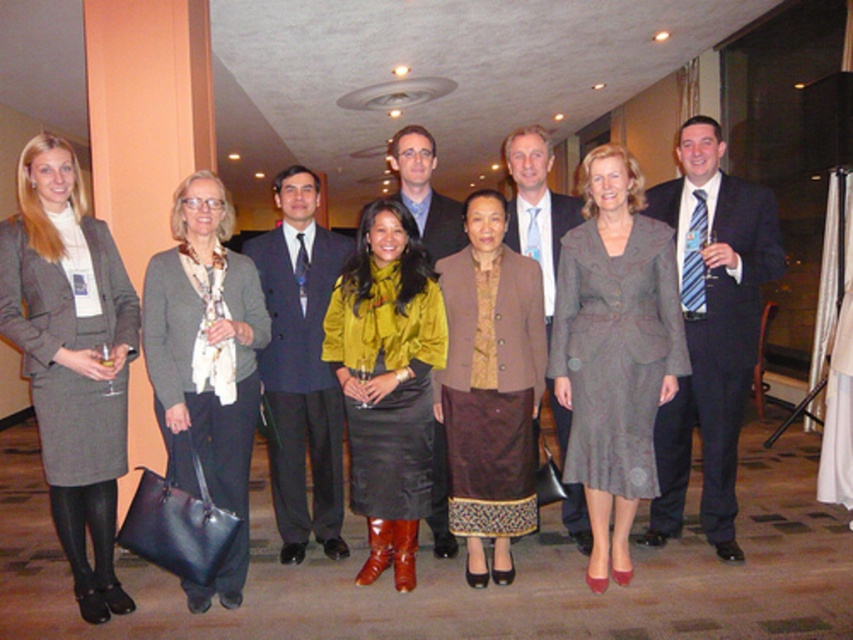
You are standing in the hallway and want to move from the point closer to you to the point further away. Which path should you take to go from the point at point (596, 388) to the point at point (508, 164)?

The path you should take is moving from point (596, 388) to point (508, 164) since point (596, 388) is closer to the viewer and you need to move towards the point further away.